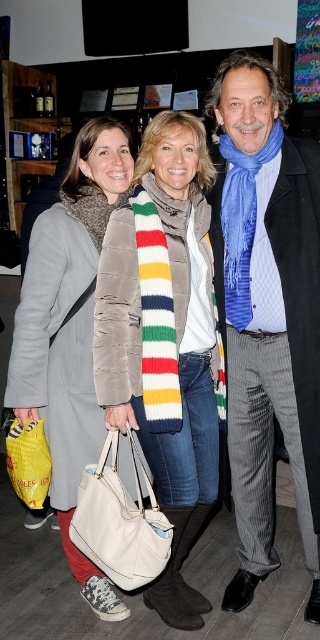
Question: Which point is farther to the camera?

Choices:
 (A) blue silk scarf at center
 (B) yellow fabric bag at lower left

Answer: (B)

Question: Can you confirm if white leather handbag at center is positioned below yellow fabric bag at lower left?

Choices:
 (A) yes
 (B) no

Answer: (A)

Question: Where is matte gray coat at center located in relation to white leather handbag at center in the image?

Choices:
 (A) above
 (B) below

Answer: (A)

Question: Is blue silk scarf at center in front of yellow fabric bag at lower left?

Choices:
 (A) no
 (B) yes

Answer: (B)

Question: Which point is closer to the camera?

Choices:
 (A) white leather handbag at center
 (B) yellow fabric bag at lower left
 (C) matte gray coat at center

Answer: (A)

Question: Which is nearer to the white leather handbag at center?

Choices:
 (A) matte gray coat at center
 (B) striped wool scarf at center

Answer: (A)